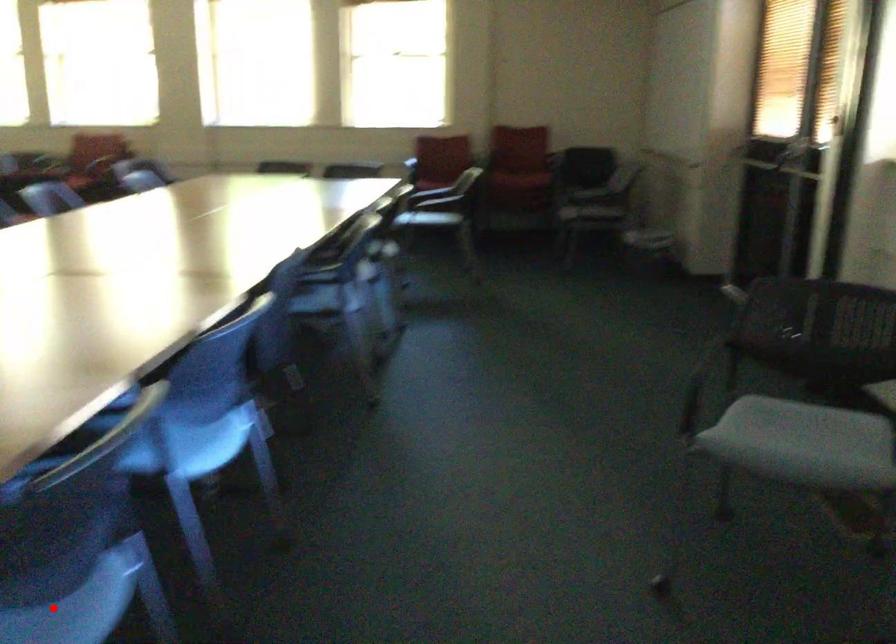
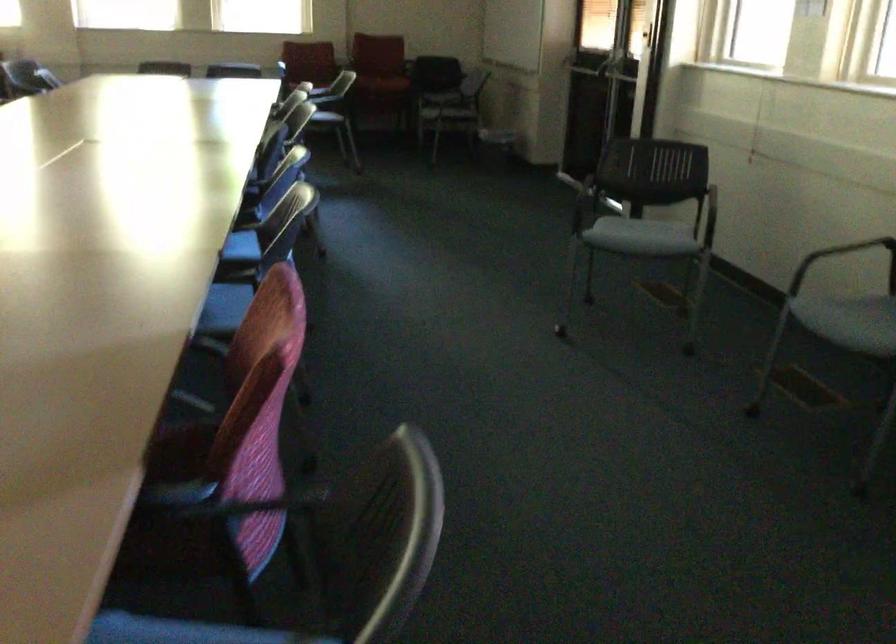
Question: I am providing you with two images of the same scene from different viewpoints. A red point is marked on the first image. Is the red point's position out of view in image 2?

Choices:
 (A) Yes
 (B) No

Answer: (A)